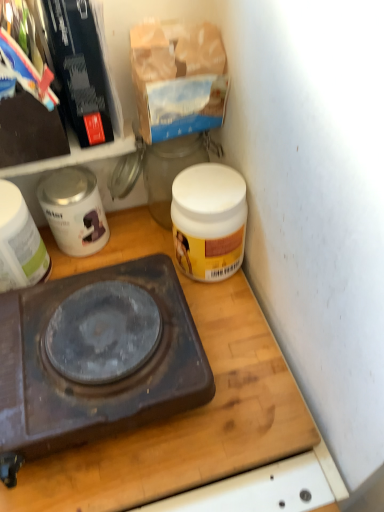
Question: Is wooden cutting board at center bigger than dark brown plastic gas stove at center?

Choices:
 (A) no
 (B) yes

Answer: (A)

Question: Could you tell me if wooden cutting board at center is facing dark brown plastic gas stove at center?

Choices:
 (A) no
 (B) yes

Answer: (A)

Question: Is wooden cutting board at center wider than dark brown plastic gas stove at center?

Choices:
 (A) no
 (B) yes

Answer: (B)

Question: From a real-world perspective, does wooden cutting board at center stand above dark brown plastic gas stove at center?

Choices:
 (A) yes
 (B) no

Answer: (B)

Question: Is dark brown plastic gas stove at center located within wooden cutting board at center?

Choices:
 (A) yes
 (B) no

Answer: (B)

Question: Considering the relative sizes of wooden cutting board at center and dark brown plastic gas stove at center in the image provided, is wooden cutting board at center shorter than dark brown plastic gas stove at center?

Choices:
 (A) no
 (B) yes

Answer: (B)

Question: Is white glossy jar at left, arranged as the 2th appliance when viewed from the right, positioned with its back to white glossy canister at upper left, the 2th appliance positioned from the left?

Choices:
 (A) no
 (B) yes

Answer: (A)

Question: Can you confirm if white glossy jar at left, arranged as the 2th appliance when viewed from the right, is shorter than white glossy canister at upper left, placed as the first appliance when sorted from right to left?

Choices:
 (A) no
 (B) yes

Answer: (A)

Question: Is white glossy jar at left, arranged as the 2th appliance when viewed from the right, further to camera compared to white glossy canister at upper left, placed as the first appliance when sorted from right to left?

Choices:
 (A) no
 (B) yes

Answer: (A)

Question: From the image's perspective, is white glossy jar at left, arranged as the 2th appliance when viewed from the right, over white glossy canister at upper left, placed as the first appliance when sorted from right to left?

Choices:
 (A) no
 (B) yes

Answer: (A)

Question: Can you confirm if white glossy jar at left, the first appliance positioned from the left, is bigger than white glossy canister at upper left, placed as the first appliance when sorted from right to left?

Choices:
 (A) no
 (B) yes

Answer: (B)

Question: Is white glossy jar at left, arranged as the 2th appliance when viewed from the right, touching white glossy canister at upper left, the 2th appliance positioned from the left?

Choices:
 (A) no
 (B) yes

Answer: (B)

Question: From a real-world perspective, is white glossy canister at upper left, the 2th appliance positioned from the left, positioned over dark brown plastic gas stove at center based on gravity?

Choices:
 (A) no
 (B) yes

Answer: (B)